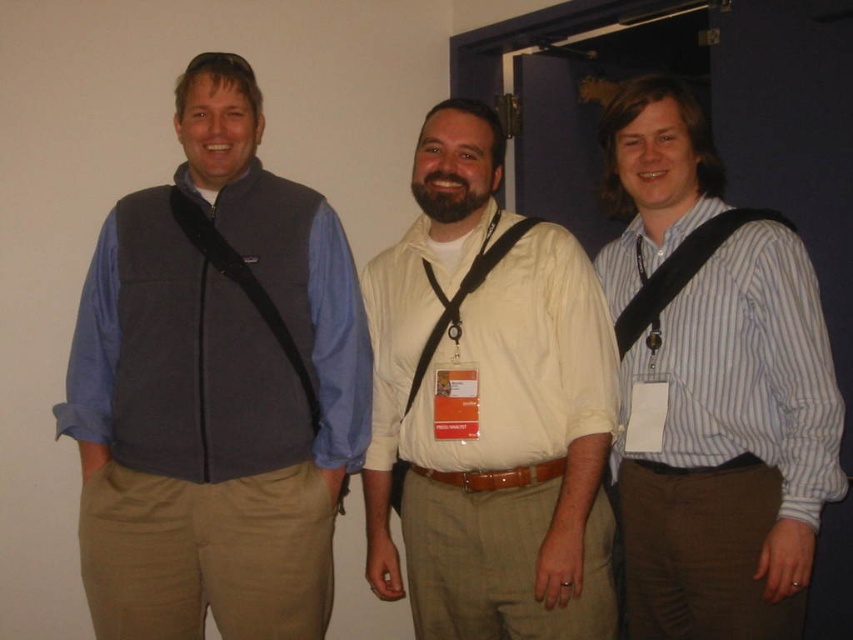
Consider the image. You are organizing a photo shoot and need to ensure that the light beige shirt at center and the black fabric strap at right are both visible in the frame. Given that the camera can only capture objects up to the width of the wider object, which object determines the minimum required frame width?

The light beige shirt at center has a larger width than the black fabric strap at right, so the minimum required frame width must accommodate the light beige shirt at center.

In the scene shown: You are a photographer at the event and need to position yourself to capture both the matte blue vest at left and the light beige shirt at center in the same frame. Based on their positions, which one should you focus on first to ensure both are in focus?

The matte blue vest at left is above the light beige shirt at center, so you should focus on the matte blue vest at left first to ensure both are in focus.

Looking at this image, you are a photographer positioned at the entrance of the hallway. You need to capture a photo of both the matte blue vest at left and the light beige shirt at center without any obstructions. Given that your camera has a maximum focus range of 10 inches, can you take the photo from your current position?

The distance between the matte blue vest at left and the light beige shirt at center is 11.65 inches, which exceeds the camera maximum focus range of 10 inches. Therefore, you cannot take the photo from your current position.